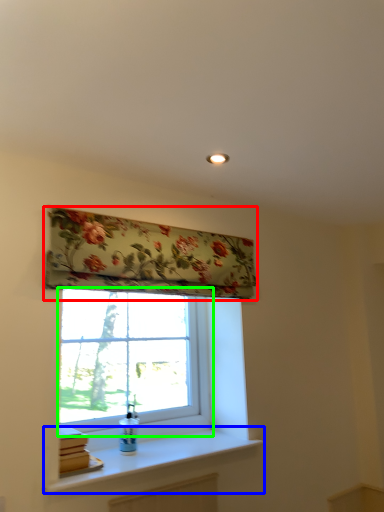
Question: Considering the real-world distances, which object is farthest from window blind (highlighted by a red box)? window sill (highlighted by a blue box) or window (highlighted by a green box)?

Choices:
 (A) window sill
 (B) window

Answer: (A)